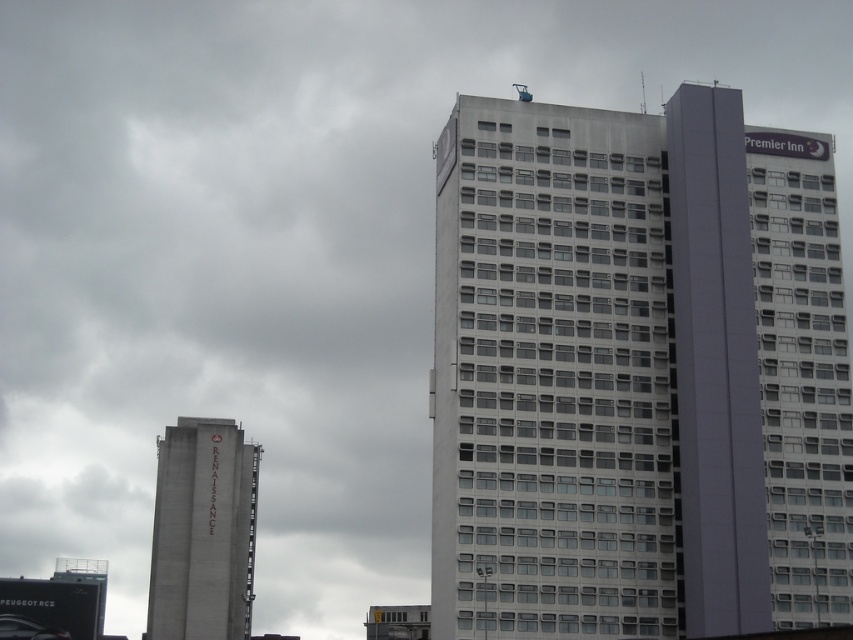
Can you confirm if white glass building at center is positioned to the right of concrete tower at left?

Indeed, white glass building at center is positioned on the right side of concrete tower at left.

Which of these two, white glass building at center or concrete tower at left, stands taller?

With more height is white glass building at center.

The height and width of the screenshot is (640, 853). In order to click on white glass building at center in this screenshot , I will do `click(637, 372)`.